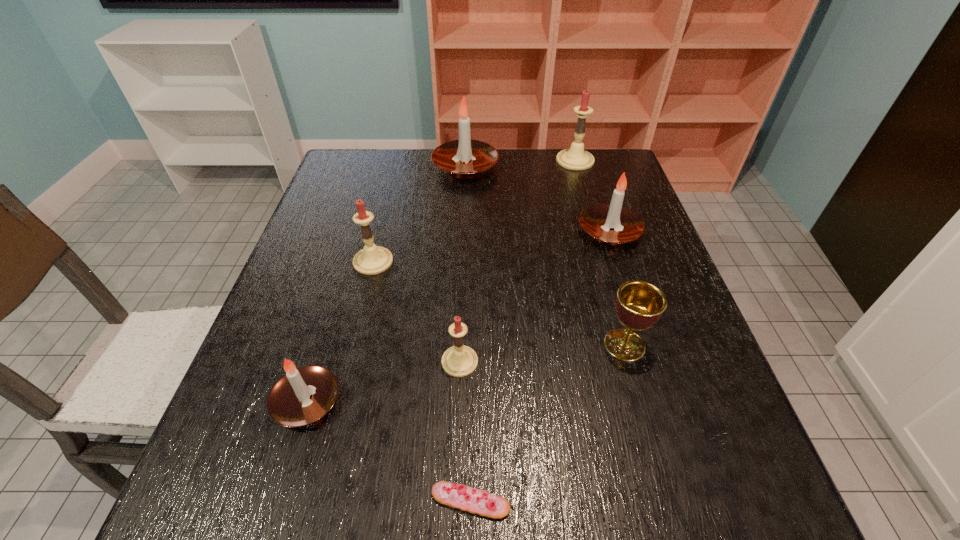
Find the location of a particular element. The height and width of the screenshot is (540, 960). free point located 0.390m on the back of the smallest white candle is located at coordinates [x=355, y=241].

At what (x,y) coordinates should I click in order to perform the action: click on free spot located 0.080m on the left of the nearest red candle. Please return your answer as a coordinate pair (x, y). This screenshot has height=540, width=960. Looking at the image, I should click on (401, 362).

You are a GUI agent. You are given a task and a screenshot of the screen. Output one action in this format:
    pyautogui.click(x=<x>, y=<y>)
    Task: Click on the vacant space located 0.230m on the back of the nearest object
    
    Given the screenshot: What is the action you would take?
    pyautogui.click(x=472, y=362)

Identify the location of object that is at the near edge. (477, 501).

This screenshot has width=960, height=540. Identify the location of chalice located in the right edge section of the desktop. (639, 305).

Find the location of a particular element. object situated at the far right corner is located at coordinates (576, 158).

Locate an element on the screen. free space at the far edge of the desktop is located at coordinates (402, 191).

Identify the location of blank area at the left edge. This screenshot has width=960, height=540. (371, 200).

Identify the location of vacant space at the right edge of the desktop. (633, 268).

Find the location of a particular element. The image size is (960, 540). vacant space at the far left corner of the desktop is located at coordinates (349, 185).